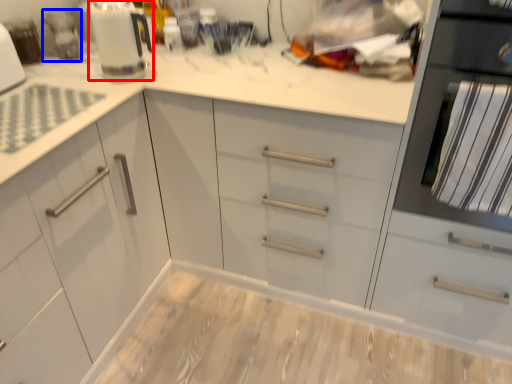
Question: Which object is further to the camera taking this photo, kitchen appliance (highlighted by a red box) or appliance (highlighted by a blue box)?

Choices:
 (A) kitchen appliance
 (B) appliance

Answer: (B)